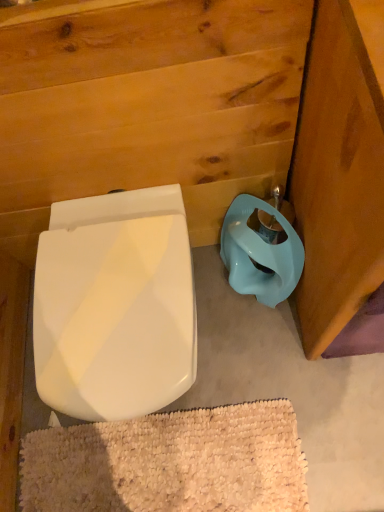
Locate an element on the screen. blank space situated above white textured bath mat at lower center (from a real-world perspective) is located at coordinates (155, 462).